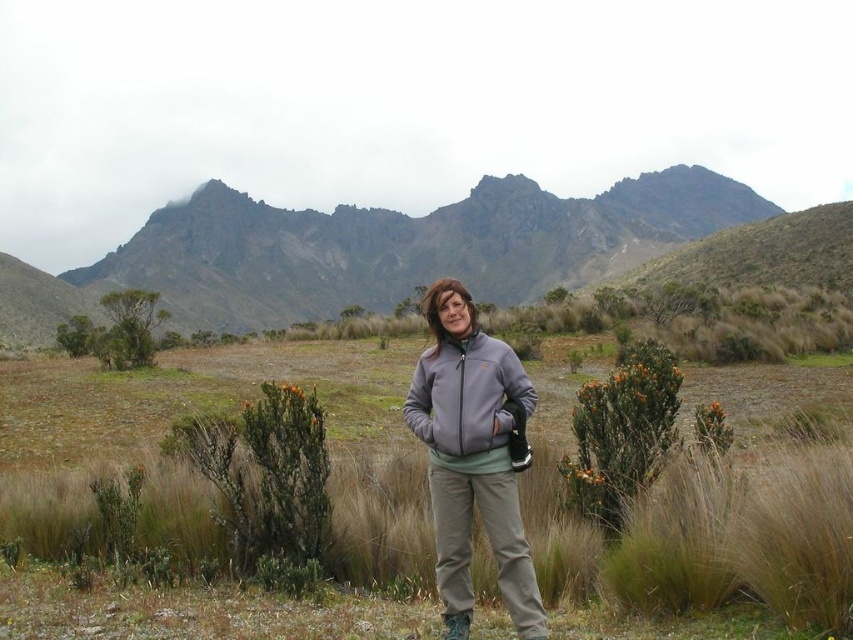
Looking at this image, you are a photographer trying to capture the person in the scene. Since both the gray fleece jacket at center and the gray fleece sweatshirt at center are in the frame, which one appears larger in your photo?

The gray fleece jacket at center appears larger because it is closer to the viewer than the gray fleece sweatshirt at center.

You are a photographer planning to take a photo of the mountain range in the background. You notice two clothing items on the person in the image, the gray fleece jacket at center and the gray fleece sweatshirt at center. Which clothing item appears narrower when viewed from your camera position?

The gray fleece jacket at center appears narrower compared to the gray fleece sweatshirt at center.